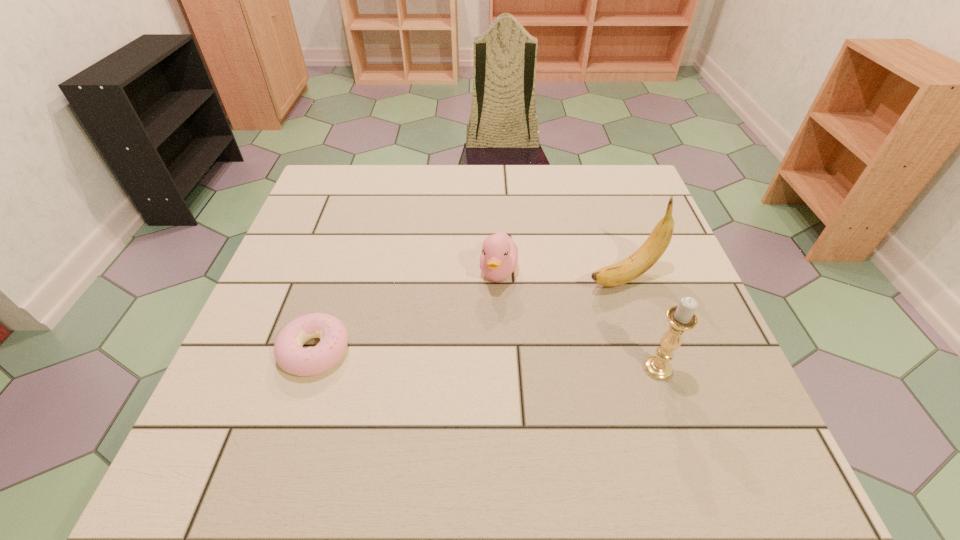
Where is `the leftmost object`? The height and width of the screenshot is (540, 960). the leftmost object is located at coordinates (289, 353).

Where is `the shortest object`? The height and width of the screenshot is (540, 960). the shortest object is located at coordinates (289, 353).

At what (x,y) coordinates should I click in order to perform the action: click on candle holder. Please return your answer as a coordinate pair (x, y). Looking at the image, I should click on (x=681, y=318).

Locate an element on the screen. The image size is (960, 540). banana is located at coordinates (638, 263).

This screenshot has width=960, height=540. What are the coordinates of `duckling` in the screenshot? It's located at (499, 256).

This screenshot has height=540, width=960. I want to click on the third tallest object, so click(499, 256).

You are a GUI agent. You are given a task and a screenshot of the screen. Output one action in this format:
    pyautogui.click(x=<x>, y=<y>)
    Task: Click on the free spot located on the back of the shortest object
    
    Given the screenshot: What is the action you would take?
    pyautogui.click(x=345, y=258)

Find the location of a particular element. blank area located 0.250m on the left of the candle holder is located at coordinates (513, 368).

Where is `vacant space located 0.120m at the start of the peel on the banana`? This screenshot has width=960, height=540. vacant space located 0.120m at the start of the peel on the banana is located at coordinates (547, 304).

Locate an element on the screen. Image resolution: width=960 pixels, height=540 pixels. free space located at the start of the peel on the banana is located at coordinates (474, 335).